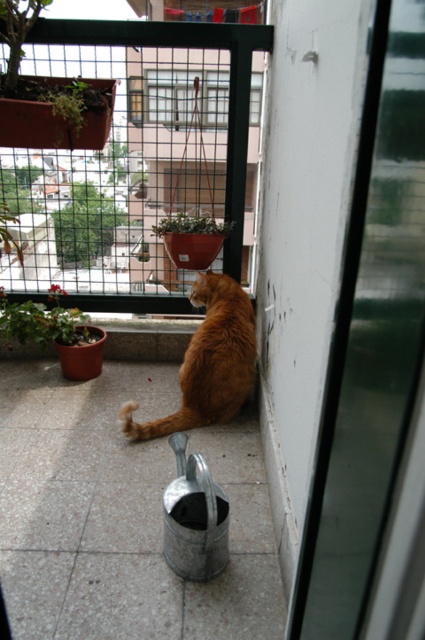
Does green matte plant at lower left have a smaller size compared to green matte plant at center?

Correct, green matte plant at lower left occupies less space than green matte plant at center.

Can you confirm if green matte plant at lower left is shorter than green matte plant at center?

Indeed, green matte plant at lower left has a lesser height compared to green matte plant at center.

I want to click on green matte plant at lower left, so click(x=42, y=320).

Identify the location of green matte plant at lower left. (42, 320).

Who is more distant from viewer, (396,264) or (234,388)?

The point (234,388) is behind.

How distant is transparent glass screen door at upper right from orange fur cat at center?

transparent glass screen door at upper right is 5.77 feet from orange fur cat at center.

Measure the distance between point (377,458) and camera.

29.85 inches

What are the coordinates of `transparent glass screen door at upper right` in the screenshot? It's located at tap(370, 339).

Does transparent glass screen door at upper right have a greater width compared to green matte plant at lower left?

In fact, transparent glass screen door at upper right might be narrower than green matte plant at lower left.

Who is lower down, transparent glass screen door at upper right or green matte plant at lower left?

Answer: transparent glass screen door at upper right

Does point (388, 304) come farther from viewer compared to point (22, 340)?

That is False.

Identify the location of transparent glass screen door at upper right. The width and height of the screenshot is (425, 640). (370, 339).